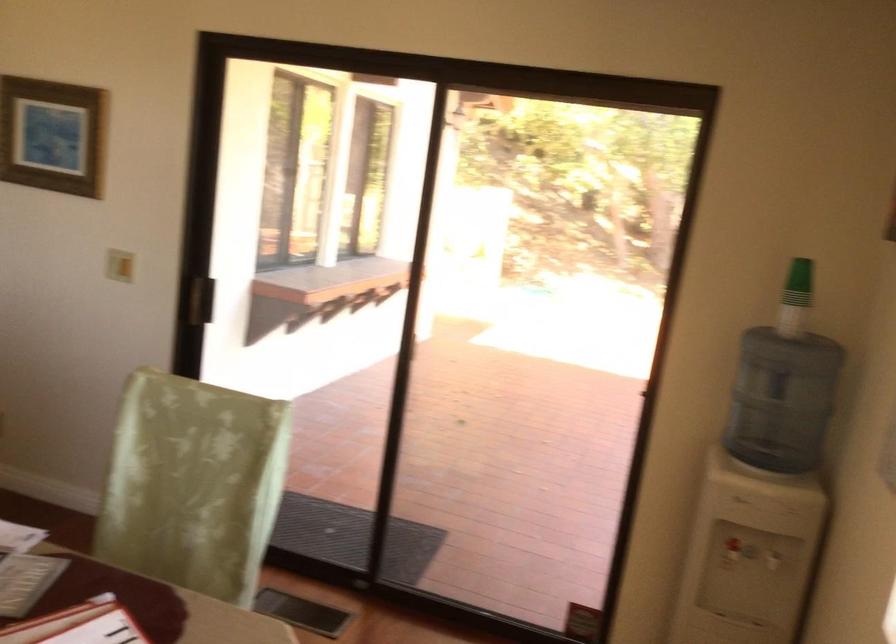
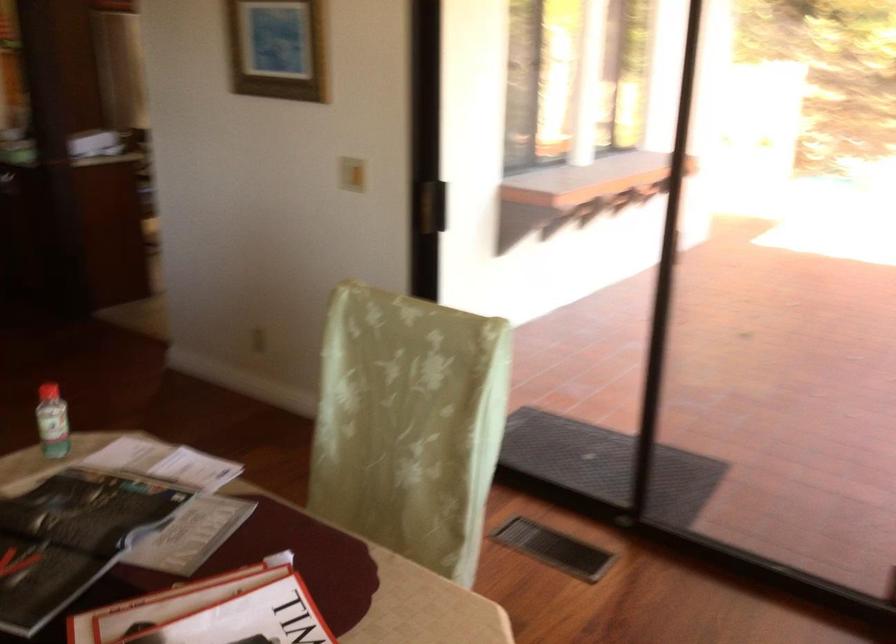
Question: Which direction would the cameraman need to move to produce the second image? Reply with the corresponding letter.

Choices:
 (A) Left
 (B) Right
 (C) Forward
 (D) Backward

Answer: (C)